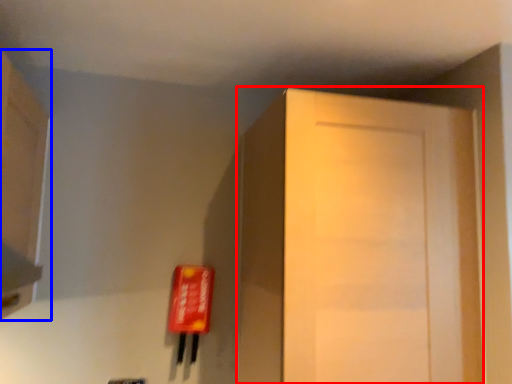
Question: Which point is closer to the camera, door (highlighted by a red box) or cabinetry (highlighted by a blue box)?

Choices:
 (A) door
 (B) cabinetry

Answer: (B)